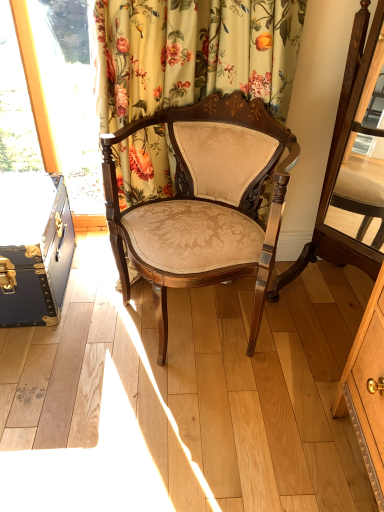
Question: Considering the relative sizes of blue leather suitcase at left and floral fabric curtain at upper center in the image provided, is blue leather suitcase at left taller than floral fabric curtain at upper center?

Choices:
 (A) yes
 (B) no

Answer: (B)

Question: Is blue leather suitcase at left oriented towards floral fabric curtain at upper center?

Choices:
 (A) no
 (B) yes

Answer: (A)

Question: Does blue leather suitcase at left have a lesser width compared to floral fabric curtain at upper center?

Choices:
 (A) no
 (B) yes

Answer: (A)

Question: Is floral fabric curtain at upper center inside blue leather suitcase at left?

Choices:
 (A) no
 (B) yes

Answer: (A)

Question: Is blue leather suitcase at left positioned behind floral fabric curtain at upper center?

Choices:
 (A) yes
 (B) no

Answer: (A)

Question: Does point (352, 145) appear closer or farther from the camera than point (168, 268)?

Choices:
 (A) farther
 (B) closer

Answer: (A)

Question: From a real-world perspective, is matte brown wood swivel chair at center physically located above or below matte gold upholstery chair at center?

Choices:
 (A) above
 (B) below

Answer: (A)

Question: From their relative heights in the image, would you say matte brown wood swivel chair at center is taller or shorter than matte gold upholstery chair at center?

Choices:
 (A) short
 (B) tall

Answer: (B)

Question: From the image's perspective, relative to matte gold upholstery chair at center, is matte brown wood swivel chair at center above or below?

Choices:
 (A) below
 (B) above

Answer: (B)

Question: Is matte brown wood swivel chair at center in front of or behind floral fabric curtain at upper center in the image?

Choices:
 (A) front
 (B) behind

Answer: (A)

Question: In terms of height, does matte brown wood swivel chair at center look taller or shorter compared to floral fabric curtain at upper center?

Choices:
 (A) tall
 (B) short

Answer: (A)

Question: In terms of size, does matte brown wood swivel chair at center appear bigger or smaller than floral fabric curtain at upper center?

Choices:
 (A) big
 (B) small

Answer: (B)

Question: Do you think matte brown wood swivel chair at center is within floral fabric curtain at upper center, or outside of it?

Choices:
 (A) outside
 (B) inside

Answer: (A)

Question: Visually, is blue leather suitcase at left positioned to the left or to the right of matte gold upholstery chair at center?

Choices:
 (A) right
 (B) left

Answer: (B)

Question: From a real-world perspective, relative to matte gold upholstery chair at center, is blue leather suitcase at left vertically above or below?

Choices:
 (A) above
 (B) below

Answer: (B)